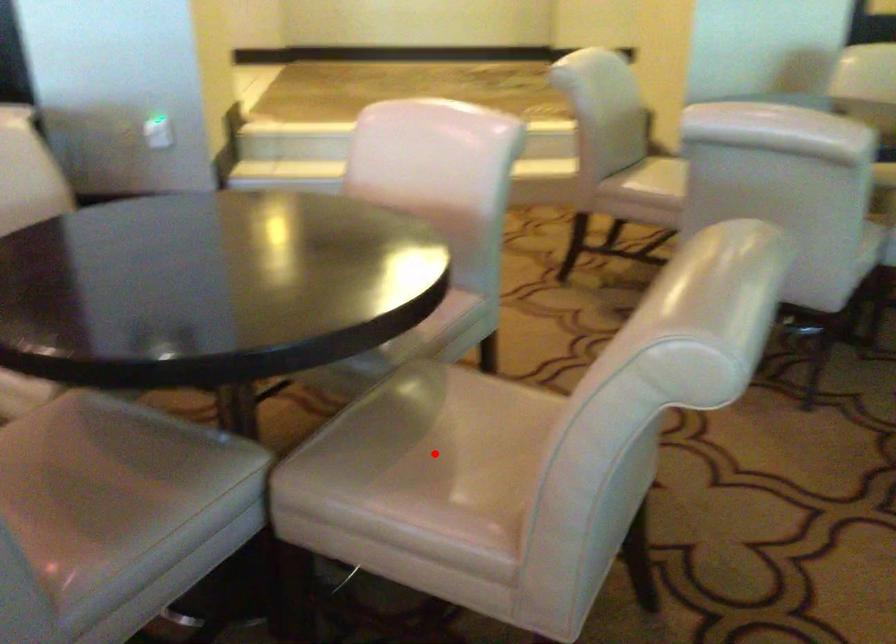
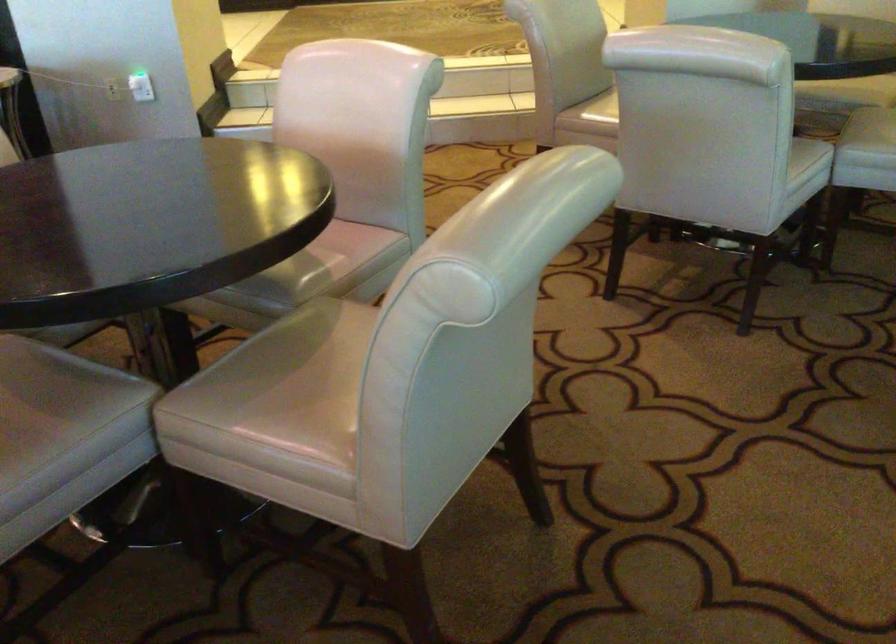
Find the pixel in the second image that matches the highlighted location in the first image.

(311, 383)